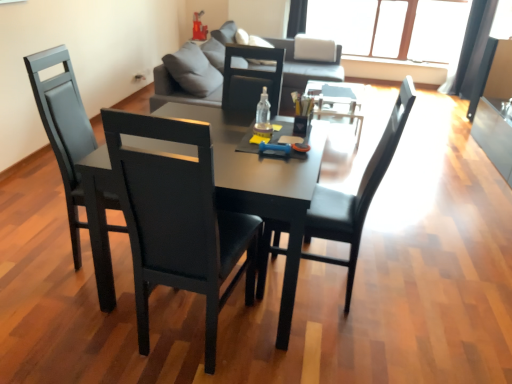
Describe the element at coordinates (390, 26) in the screenshot. The height and width of the screenshot is (384, 512). I see `transparent glass window at upper center` at that location.

Locate an element on the screen. black leather chair at left, which is the 2th chair from left to right is located at coordinates (178, 219).

You are a GUI agent. You are given a task and a screenshot of the screen. Output one action in this format:
    pyautogui.click(x=<x>, y=<y>)
    Task: Click on the matte black chair at left, the third chair viewed from the right
    The image size is (512, 384).
    Given the screenshot: What is the action you would take?
    pyautogui.click(x=63, y=128)

The width and height of the screenshot is (512, 384). What do you see at coordinates (63, 128) in the screenshot?
I see `matte black chair at left, the third chair viewed from the right` at bounding box center [63, 128].

I want to click on transparent glass window at upper center, so click(x=390, y=26).

Consider the image. Considering the relative sizes of black leather chair at left, which is the 2th chair from left to right, and matte black chair at left, the third chair viewed from the right, in the image provided, is black leather chair at left, which is the 2th chair from left to right, taller than matte black chair at left, the third chair viewed from the right,?

Indeed, black leather chair at left, which is the 2th chair from left to right, has a greater height compared to matte black chair at left, the third chair viewed from the right.

Measure the distance from black leather chair at left, which is the second chair from right to left, to matte black chair at left, the third chair viewed from the right.

The distance of black leather chair at left, which is the second chair from right to left, from matte black chair at left, the third chair viewed from the right, is 24.43 inches.

Is black leather chair at left, which is the second chair from right to left, positioned with its back to matte black chair at left, placed as the 1th chair when sorted from left to right?

No, black leather chair at left, which is the second chair from right to left, is not facing the opposite direction of matte black chair at left, placed as the 1th chair when sorted from left to right.

Is black leather chair at center, the 1th chair from the right, bigger than black leather chair at left, which is the 2th chair from left to right?

No, black leather chair at center, the 1th chair from the right, is not bigger than black leather chair at left, which is the 2th chair from left to right.

Which is more to the right, black leather chair at center, the 1th chair from the right, or black leather chair at left, which is the 2th chair from left to right?

black leather chair at center, the 1th chair from the right.

Does black leather chair at center, the 1th chair from the right, come behind black leather chair at left, which is the second chair from right to left?

Yes, it is.

Between black leather chair at left, which is the second chair from right to left, and transparent plastic organizer at center, which one is positioned in front?

black leather chair at left, which is the second chair from right to left, is in front.

Which is behind, point (164, 131) or point (336, 101)?

Positioned behind is point (336, 101).

Can you tell me how much black leather chair at left, which is the second chair from right to left, and transparent plastic organizer at center differ in facing direction?

black leather chair at left, which is the second chair from right to left, and transparent plastic organizer at center are facing 92.6 degrees away from each other.

In the scene shown: Does black leather chair at left, which is the second chair from right to left, have a greater width compared to transparent plastic organizer at center?

Incorrect, the width of black leather chair at left, which is the second chair from right to left, does not surpass that of transparent plastic organizer at center.

In the image, is black leather chair at left, which is the 2th chair from left to right, on the left side or the right side of black leather chair at center, the third chair from the left?

black leather chair at left, which is the 2th chair from left to right, is positioned on black leather chair at center, the third chair from the left,'s left side.

Is black leather chair at left, which is the second chair from right to left, not inside black leather chair at center, the third chair from the left?

Absolutely, black leather chair at left, which is the second chair from right to left, is external to black leather chair at center, the third chair from the left.

From the image's perspective, would you say transparent plastic organizer at center is shown under black leather chair at center, the 1th chair from the right?

Actually, transparent plastic organizer at center appears above black leather chair at center, the 1th chair from the right, in the image.

From the transparent plastic organizer at center, count 2nd chairs forward and point to it. Please provide its 2D coordinates.

[(356, 195)]

How many degrees apart are the facing directions of transparent plastic organizer at center and black leather chair at center, the 1th chair from the right?

transparent plastic organizer at center and black leather chair at center, the 1th chair from the right, are facing 175 degrees away from each other.

Which is behind, transparent glass window at upper center or matte black chair at left, the third chair viewed from the right?

transparent glass window at upper center is more distant.

Between transparent glass window at upper center and matte black chair at left, placed as the 1th chair when sorted from left to right, which one appears on the left side from the viewer's perspective?

From the viewer's perspective, matte black chair at left, placed as the 1th chair when sorted from left to right, appears more on the left side.

Does transparent glass window at upper center turn towards matte black chair at left, the third chair viewed from the right?

Yes, transparent glass window at upper center is oriented towards matte black chair at left, the third chair viewed from the right.

Can you tell me how much transparent glass window at upper center and matte black chair at left, the third chair viewed from the right, differ in facing direction?

94.9 degrees.

Is transparent glass window at upper center situated inside black leather chair at left, which is the 2th chair from left to right, or outside?

transparent glass window at upper center exists outside the volume of black leather chair at left, which is the 2th chair from left to right.

The height and width of the screenshot is (384, 512). What are the coordinates of `window lying on the right of black leather chair at left, which is the 2th chair from left to right` in the screenshot? It's located at (390, 26).

Considering the relative sizes of transparent glass window at upper center and black leather chair at left, which is the 2th chair from left to right, in the image provided, is transparent glass window at upper center bigger than black leather chair at left, which is the 2th chair from left to right,?

Indeed, transparent glass window at upper center has a larger size compared to black leather chair at left, which is the 2th chair from left to right.

Is transparent glass window at upper center at the right side of black leather chair at left, which is the 2th chair from left to right?

Indeed, transparent glass window at upper center is positioned on the right side of black leather chair at left, which is the 2th chair from left to right.

At what (x,y) coordinates should I click in order to perform the action: click on the 2nd chair directly beneath the black leather chair at left, which is the second chair from right to left (from a real-world perspective). Please return your answer as a coordinate pair (x, y). This screenshot has height=384, width=512. Looking at the image, I should click on (63, 128).

Identify the location of chair in front of the black leather chair at center, the third chair from the left. (178, 219).

From the image, which object appears to be nearer to transparent plastic organizer at center, black leather chair at left, which is the 2th chair from left to right, or matte black table at center?

matte black table at center.

When comparing their distances from black leather chair at center, the 1th chair from the right, does transparent glass window at upper center or transparent plastic bottle at center seem further?

transparent glass window at upper center.

From the image, which object appears to be farther from matte black table at center, transparent plastic organizer at center or matte black chair at left, the third chair viewed from the right?

Based on the image, transparent plastic organizer at center appears to be further to matte black table at center.

From the image, which object appears to be farther from black leather chair at center, the 1th chair from the right, transparent plastic organizer at center or dark gray leather couch at upper center?

dark gray leather couch at upper center is further to black leather chair at center, the 1th chair from the right.

Looking at the image, which one is located further to transparent plastic bottle at center, black leather chair at left, which is the 2th chair from left to right, or matte black table at center?

Among the two, black leather chair at left, which is the 2th chair from left to right, is located further to transparent plastic bottle at center.

From the image, which object appears to be nearer to black leather chair at center, the third chair from the left, matte black chair at left, the third chair viewed from the right, or black leather chair at left, which is the second chair from right to left?

black leather chair at left, which is the second chair from right to left, is closer to black leather chair at center, the third chair from the left.

Based on their spatial positions, is transparent glass window at upper center or matte black table at center further from black leather chair at center, the 1th chair from the right?

transparent glass window at upper center is further to black leather chair at center, the 1th chair from the right.

Based on their spatial positions, is black leather chair at left, which is the second chair from right to left, or dark gray leather couch at upper center closer to black leather chair at center, the third chair from the left?

black leather chair at left, which is the second chair from right to left.

I want to click on chair between black leather chair at center, the 1th chair from the right, and transparent plastic organizer at center from front to back, so click(x=63, y=128).

The width and height of the screenshot is (512, 384). I want to click on coffee table positioned between black leather chair at left, which is the 2th chair from left to right, and transparent glass window at upper center from near to far, so click(x=338, y=102).

Where is `studio couch located between black leather chair at left, which is the 2th chair from left to right, and transparent glass window at upper center in the depth direction`? The image size is (512, 384). studio couch located between black leather chair at left, which is the 2th chair from left to right, and transparent glass window at upper center in the depth direction is located at coordinates (305, 69).

Find the location of `studio couch between matte black chair at left, the third chair viewed from the right, and transparent glass window at upper center, along the z-axis`. studio couch between matte black chair at left, the third chair viewed from the right, and transparent glass window at upper center, along the z-axis is located at coordinates (305, 69).